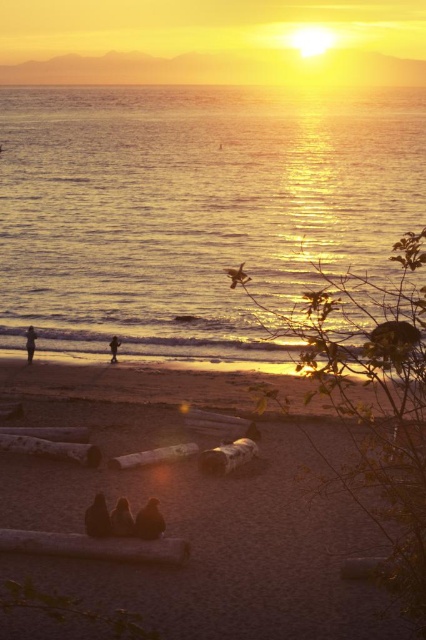
Question: Which object appears closest to the camera in this image?

Choices:
 (A) dark brown fur at center
 (B) dark brown fur at lower left

Answer: (B)

Question: Among these objects, which one is farthest from the camera?

Choices:
 (A) smooth brown log at lower center
 (B) dark brown fur at lower left
 (C) golden reflective water at center

Answer: (C)

Question: Is dark brown fur at center further to camera compared to silhouette figure at lower left?

Choices:
 (A) no
 (B) yes

Answer: (A)

Question: Which object is the closest to the dark brown fur at lower left?

Choices:
 (A) smooth brown log at lower center
 (B) silhouette figure at lower left
 (C) dark brown fur at center

Answer: (A)

Question: Does smooth brown log at lower center lie in front of silhouette figure at beach center?

Choices:
 (A) yes
 (B) no

Answer: (A)

Question: Can you confirm if smooth brown log at lower center is smaller than dark brown fur at center?

Choices:
 (A) no
 (B) yes

Answer: (A)